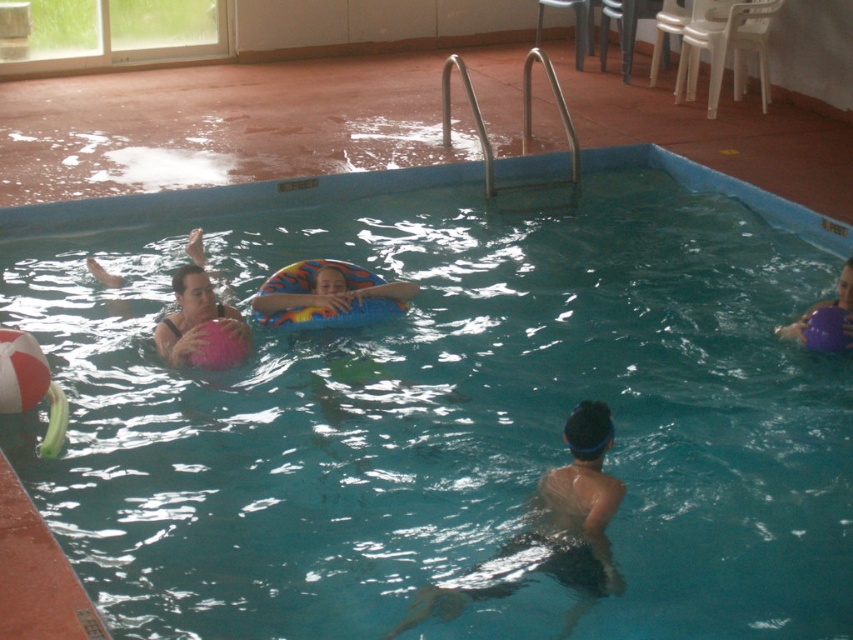
You are a lifeguard observing the pool area. You notice the multicolored rubber ring at center and the purple rubber ball at right. Which object is located to the left of the other?

The multicolored rubber ring at center is positioned on the left side of purple rubber ball at right.